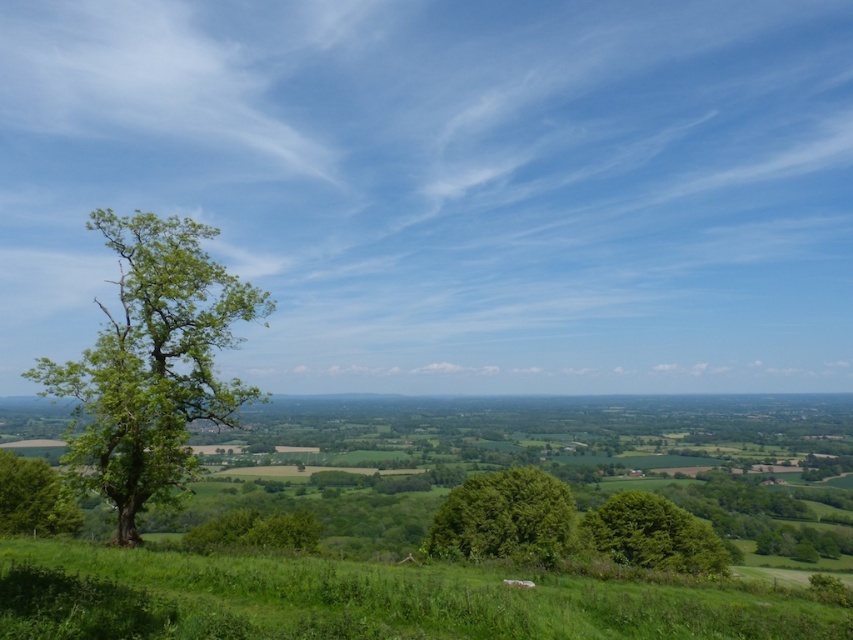
Question: Does green leafy tree at left appear under green leafy tree at center?

Choices:
 (A) no
 (B) yes

Answer: (A)

Question: Which point is farther to the camera?

Choices:
 (A) green grassy field at lower center
 (B) green leafy tree at lower right
 (C) green leafy tree at center
 (D) green leafy tree at lower left

Answer: (B)

Question: Where is green grassy field at lower center located in relation to green leafy tree at lower left in the image?

Choices:
 (A) above
 (B) below

Answer: (A)

Question: Which point is farther to the camera?

Choices:
 (A) green leafy tree at lower left
 (B) green grassy field at lower center

Answer: (A)

Question: Which object is the closest to the green grassy field at lower center?

Choices:
 (A) green leafy tree at lower left
 (B) green leafy tree at lower right

Answer: (A)

Question: Considering the relative positions of green grassy field at lower center and green leafy tree at lower right in the image provided, where is green grassy field at lower center located with respect to green leafy tree at lower right?

Choices:
 (A) right
 (B) left

Answer: (B)